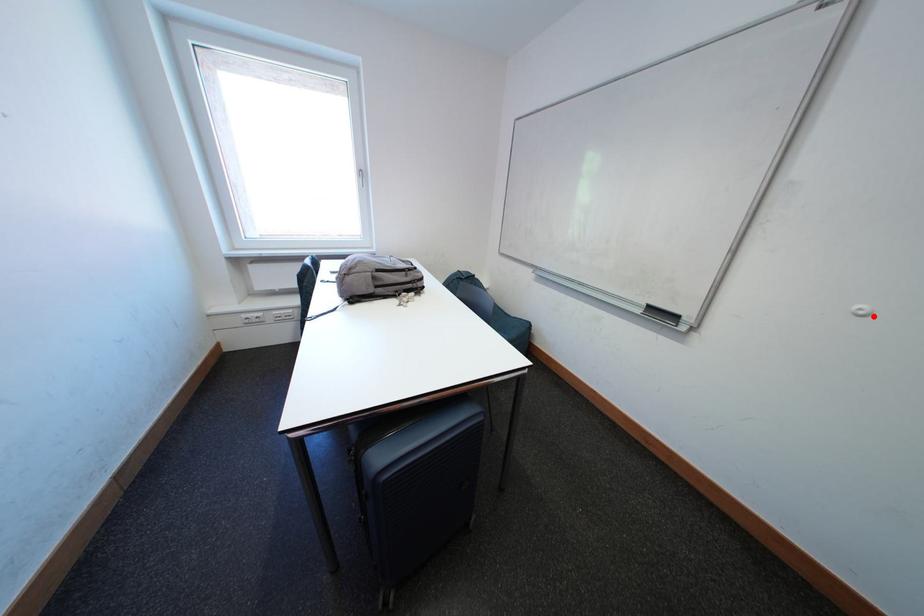
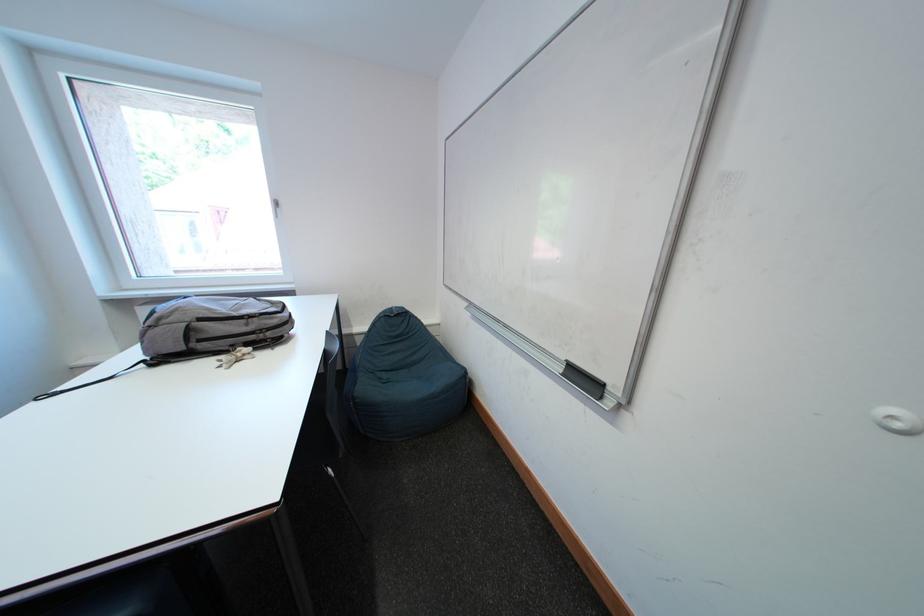
In the second image, find the point that corresponds to the highlighted location in the first image.

(906, 429)